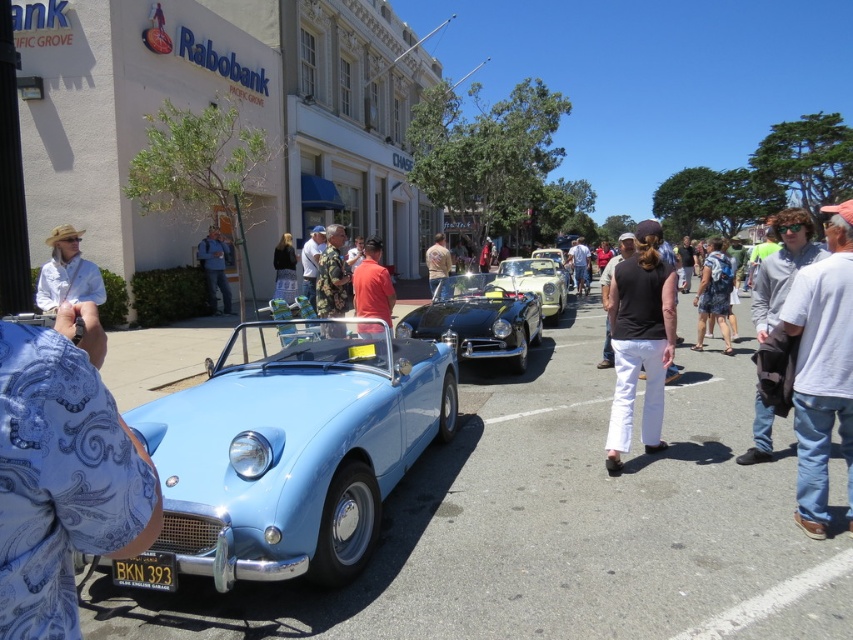
You are a photographer trying to capture both the matte orange shirt at center and the metallic gold convertible at center in a single frame. Which object should you focus on first if you want to ensure both are in focus without adjusting the camera settings?

You should focus on the metallic gold convertible at center first because it is larger than the matte orange shirt at center, allowing for a greater depth of field to include both in focus.

You are standing at the position of point (276, 250) and want to walk towards the Rabobank building. If you look towards point (711, 298), will that point be in your forward direction towards the Rabobank building?

Yes, point (711, 298) is in front of point (276, 250), so if you are standing at point (276, 250) and facing towards the Rabobank building, point (711, 298) would be in your forward direction towards it.

You are standing in the middle of the street at the car show and want to take a photo of the Rabobank building. There are two points marked on your map at coordinates point (293, 253) and point (554, 260). Which point should you stand closer to ensure the building is in focus?

You should stand closer to point (293, 253) because it is closer to the camera, which would allow the Rabobank building to be in focus better.